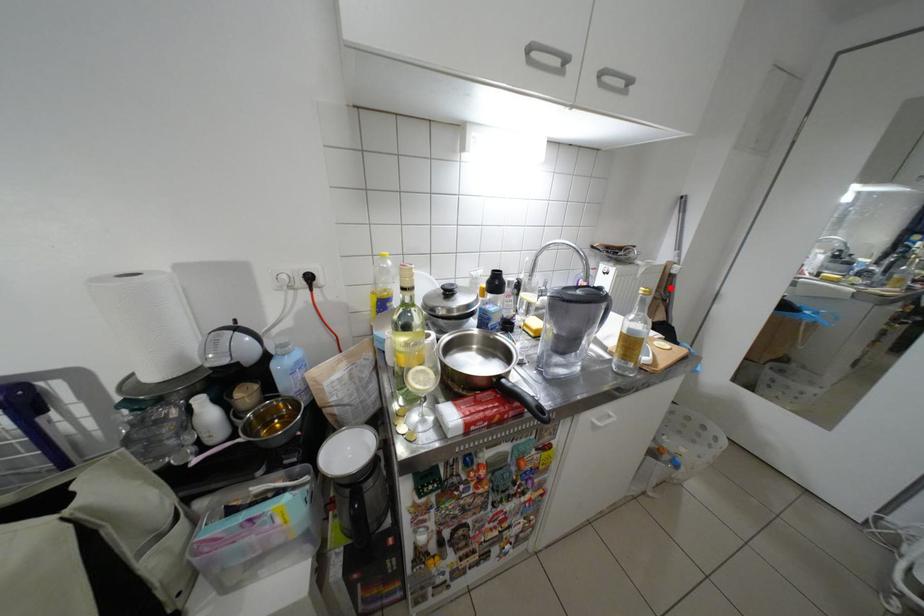
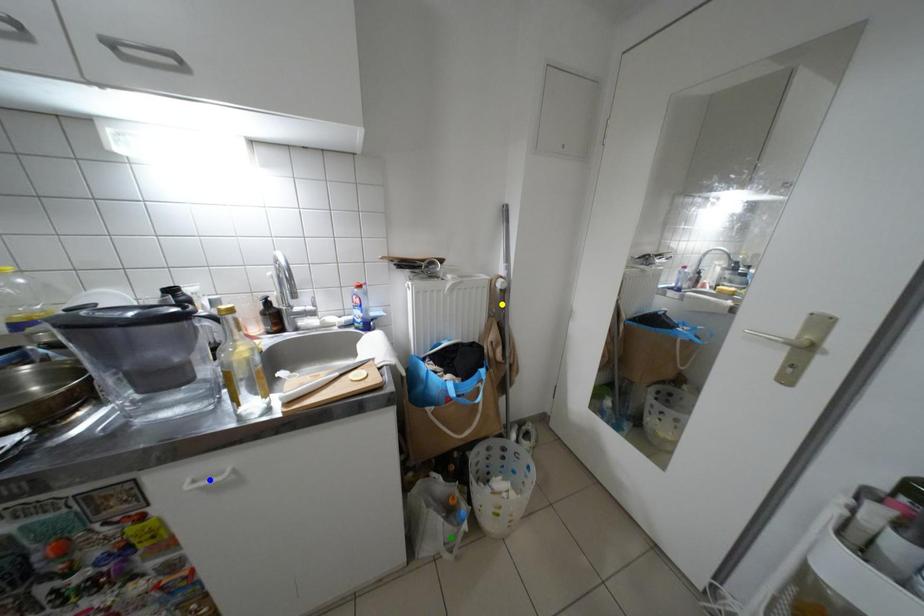
Question: I am providing you with two images of the same scene from different viewpoints. A red point is marked on the first image. You are given multiple points on the second image. In image 2, which mark is for the same physical point as the one in image 1?

Choices:
 (A) green point
 (B) yellow point
 (C) blue point

Answer: (B)